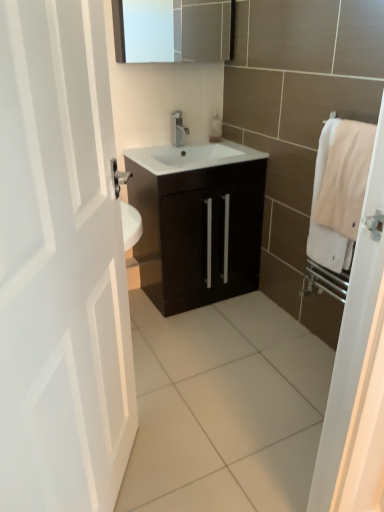
Question: Is dark wood cabinet at center not within white matte door at left?

Choices:
 (A) no
 (B) yes

Answer: (B)

Question: Does dark wood cabinet at center have a greater height compared to white matte door at left?

Choices:
 (A) no
 (B) yes

Answer: (A)

Question: Is dark wood cabinet at center smaller than white matte door at left?

Choices:
 (A) no
 (B) yes

Answer: (A)

Question: Is dark wood cabinet at center wider than white matte door at left?

Choices:
 (A) yes
 (B) no

Answer: (A)

Question: From a real-world perspective, does dark wood cabinet at center sit lower than white matte door at left?

Choices:
 (A) no
 (B) yes

Answer: (B)

Question: Are dark wood cabinet at center and white matte door at left beside each other?

Choices:
 (A) no
 (B) yes

Answer: (A)

Question: Can you confirm if translucent plastic soap dispenser at center is positioned to the right of matte silver medicine cabinet at upper center?

Choices:
 (A) yes
 (B) no

Answer: (A)

Question: Does translucent plastic soap dispenser at center have a lesser height compared to matte silver medicine cabinet at upper center?

Choices:
 (A) yes
 (B) no

Answer: (A)

Question: Does translucent plastic soap dispenser at center have a larger size compared to matte silver medicine cabinet at upper center?

Choices:
 (A) no
 (B) yes

Answer: (A)

Question: Can you confirm if translucent plastic soap dispenser at center is wider than matte silver medicine cabinet at upper center?

Choices:
 (A) yes
 (B) no

Answer: (B)

Question: Considering the relative positions of translucent plastic soap dispenser at center and matte silver medicine cabinet at upper center in the image provided, is translucent plastic soap dispenser at center in front of matte silver medicine cabinet at upper center?

Choices:
 (A) no
 (B) yes

Answer: (A)

Question: Is translucent plastic soap dispenser at center facing away from matte silver medicine cabinet at upper center?

Choices:
 (A) yes
 (B) no

Answer: (B)

Question: From the image's perspective, is translucent plastic soap dispenser at center on top of white matte door at left?

Choices:
 (A) yes
 (B) no

Answer: (A)